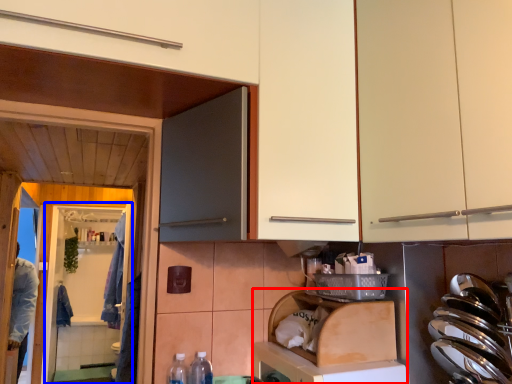
Question: Among these objects, which one is farthest to the camera, dish washer (highlighted by a red box) or screen door (highlighted by a blue box)?

Choices:
 (A) dish washer
 (B) screen door

Answer: (B)